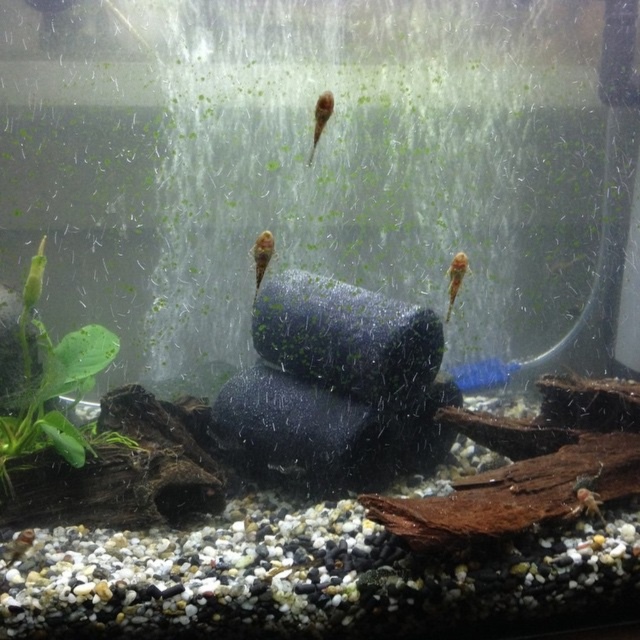
The image size is (640, 640). Describe the element at coordinates (51, 381) in the screenshot. I see `green leafy plant at left` at that location.

Between point (28, 403) and point (317, 109), which one is positioned in front?

Point (317, 109) is more forward.

The height and width of the screenshot is (640, 640). I want to click on green leafy plant at left, so click(x=51, y=381).

Is the position of translucent yellowish fish at center more distant than that of translucent gelatinous tadpole at upper center?

Yes, it is behind translucent gelatinous tadpole at upper center.

The image size is (640, 640). I want to click on translucent yellowish fish at center, so click(260, 253).

You are a GUI agent. You are given a task and a screenshot of the screen. Output one action in this format:
    pyautogui.click(x=<x>, y=<y>)
    Task: Click on the translucent yellowish fish at center
    The width and height of the screenshot is (640, 640).
    Given the screenshot: What is the action you would take?
    pyautogui.click(x=260, y=253)

The image size is (640, 640). I want to click on translucent gelatinous tadpole at upper center, so click(321, 118).

Is translucent gelatinous tadpole at upper center wider than translucent orange fish at center?

In fact, translucent gelatinous tadpole at upper center might be narrower than translucent orange fish at center.

Find the location of `translucent gelatinous tadpole at upper center`. translucent gelatinous tadpole at upper center is located at coordinates (321, 118).